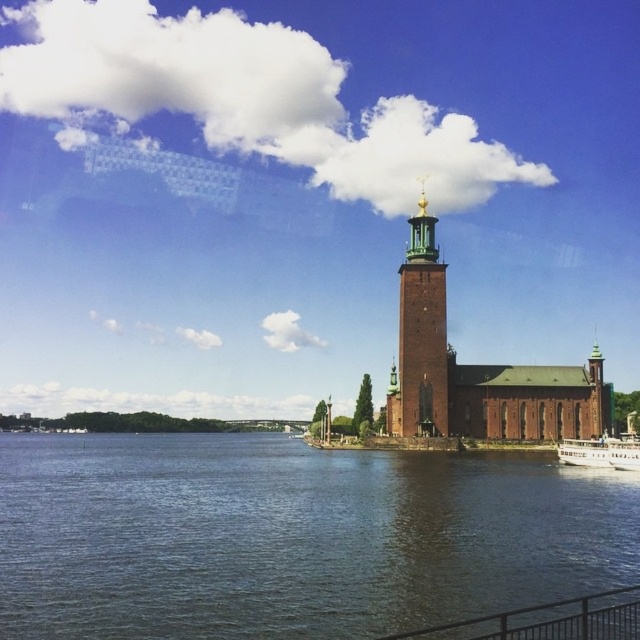
Can you confirm if red brick tower at center is positioned to the left of white wooden boat at lower right?

Correct, you'll find red brick tower at center to the left of white wooden boat at lower right.

Is red brick tower at center taller than white wooden boat at lower right?

Yes, red brick tower at center is taller than white wooden boat at lower right.

Which is behind, point (440, 381) or point (561, 444)?

The point (561, 444) is behind.

Where is `red brick tower at center`? The image size is (640, 640). red brick tower at center is located at coordinates (420, 337).

In order to click on brown brick church at center in this screenshot , I will do `click(477, 371)`.

Which of these two, brown brick church at center or red brick tower at center, stands taller?

Standing taller between the two is red brick tower at center.

This screenshot has height=640, width=640. Describe the element at coordinates (477, 371) in the screenshot. I see `brown brick church at center` at that location.

The height and width of the screenshot is (640, 640). What are the coordinates of `brown brick church at center` in the screenshot? It's located at (477, 371).

Who is more distant from viewer, [410,529] or [442,410]?

The point [442,410] is behind.

Is point (150, 627) farther from viewer compared to point (413, 298)?

That is False.

At what (x,y) coordinates should I click in order to perform the action: click on dark blue water at center. Please return your answer as a coordinate pair (x, y). The width and height of the screenshot is (640, 640). Looking at the image, I should click on (291, 536).